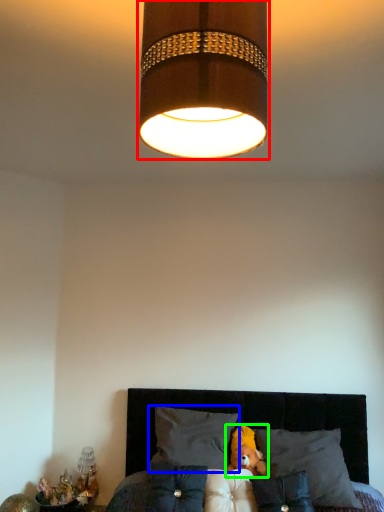
Question: Which is nearer to the lamp (highlighted by a red box)? pillow (highlighted by a blue box) or teddy (highlighted by a green box).

Choices:
 (A) pillow
 (B) teddy

Answer: (A)